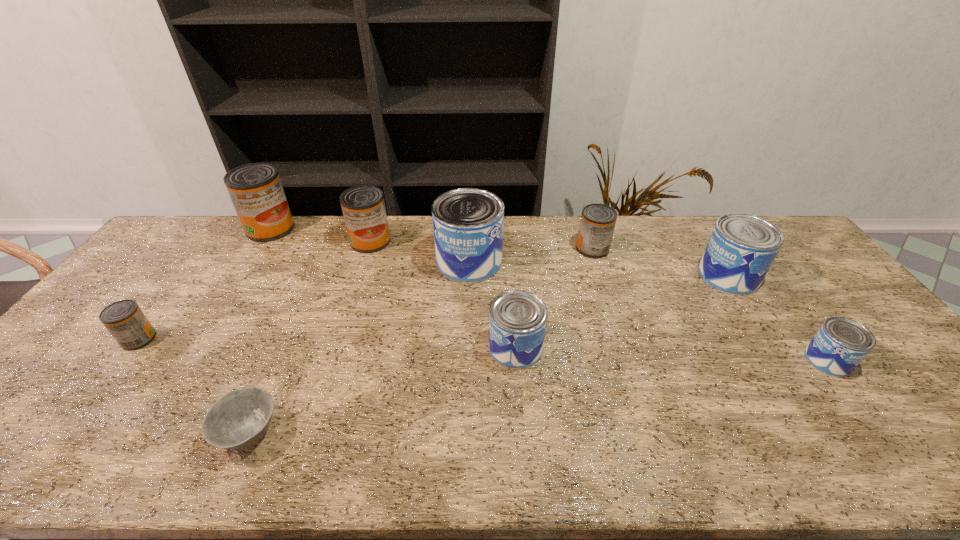
At what (x,y) coordinates should I click in order to perform the action: click on vacant point located between the nearest red can and the second smallest blue can. Please return your answer as a coordinate pair (x, y). Image resolution: width=960 pixels, height=540 pixels. Looking at the image, I should click on (327, 343).

Identify the location of free space between the second biggest blue can and the smallest blue can. (779, 318).

Where is `empty location between the leftmost can and the biggest blue can`? This screenshot has height=540, width=960. empty location between the leftmost can and the biggest blue can is located at coordinates (304, 300).

What are the coordinates of `free space between the smallest blue can and the third smallest blue can` in the screenshot? It's located at (779, 318).

You are a GUI agent. You are given a task and a screenshot of the screen. Output one action in this format:
    pyautogui.click(x=<x>, y=<y>)
    Task: Click on the object that is the closest to the nearest object
    The width and height of the screenshot is (960, 540).
    Given the screenshot: What is the action you would take?
    pyautogui.click(x=124, y=319)

Identify which object is the fourth closest to the second smallest red can. Please provide its 2D coordinates. Your answer should be formatted as a tuple, i.e. [(x, y)], where the tuple contains the x and y coordinates of a point satisfying the conditions above.

[(838, 347)]

The width and height of the screenshot is (960, 540). I want to click on can that is the fourth nearest to the leftmost object, so click(517, 318).

Where is `can that can be found as the fourth closest to the rightmost red can`? The image size is (960, 540). can that can be found as the fourth closest to the rightmost red can is located at coordinates (838, 347).

Where is `red can that is the third closest to the second biggest blue can`? This screenshot has height=540, width=960. red can that is the third closest to the second biggest blue can is located at coordinates (255, 189).

Identify which red can is located as the third nearest to the biggest red can. Please provide its 2D coordinates. Your answer should be formatted as a tuple, i.e. [(x, y)], where the tuple contains the x and y coordinates of a point satisfying the conditions above.

[(597, 224)]